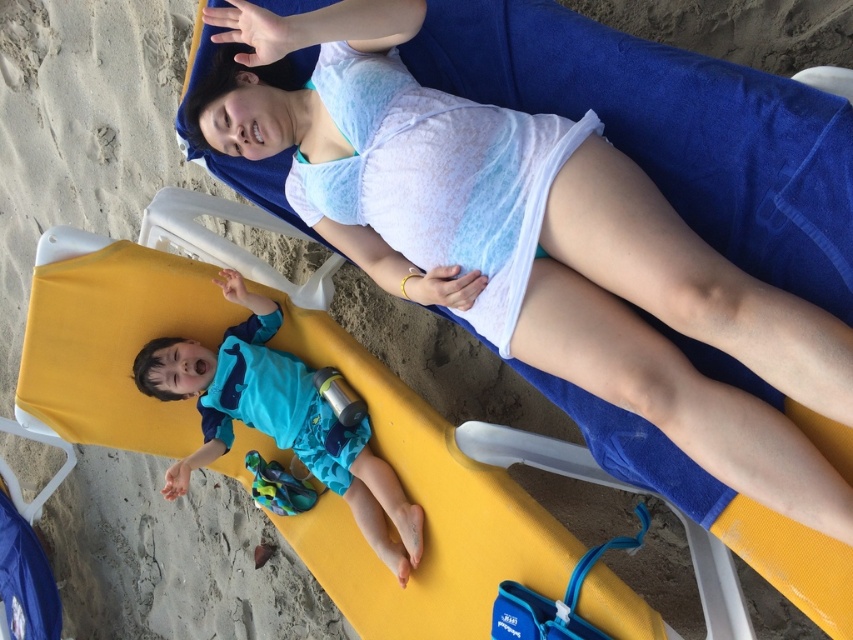
The height and width of the screenshot is (640, 853). What do you see at coordinates (685, 333) in the screenshot?
I see `blue fabric swimsuit at lower left` at bounding box center [685, 333].

Which is above, blue fabric swimsuit at lower left or blue fabric swimsuit at center?

Positioned higher is blue fabric swimsuit at lower left.

Is point (239, 20) farther from viewer compared to point (321, 474)?

No.

The width and height of the screenshot is (853, 640). I want to click on blue fabric swimsuit at lower left, so click(x=685, y=333).